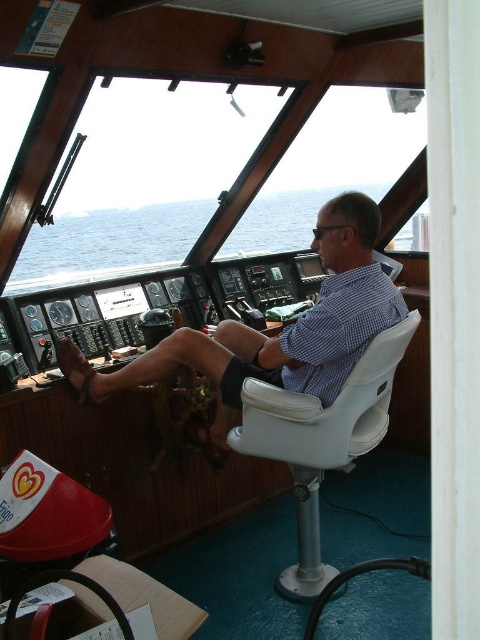
You are a passenger on the ship and want to sit down. There is a blue water at center and a white plastic chair at center. Which one can you sit on?

The white plastic chair at center is the object you can sit on, as the blue water at center is above it and likely part of the ship environment rather than a seating option.

You are a ship engineer inspecting the bridge. You need to reach both the matte blue shirt at center and the blue checkered shirt at center. Given that your arm can extend 10 centimeters, can you comfortably reach both shirts without moving your position?

The matte blue shirt at center is 10.96 centimeters away from the blue checkered shirt at center. Since your arm can only extend 10 centimeters, you cannot comfortably reach both shirts without moving your position because the distance between them exceeds your arm length.

You are an inspector checking the ship bridge. You notice two shirts on the dashboard. Which shirt is taller, the matte blue shirt at center or the blue checkered shirt at center?

The matte blue shirt at center has a greater height compared to the blue checkered shirt at center, so the matte blue shirt at center is taller.